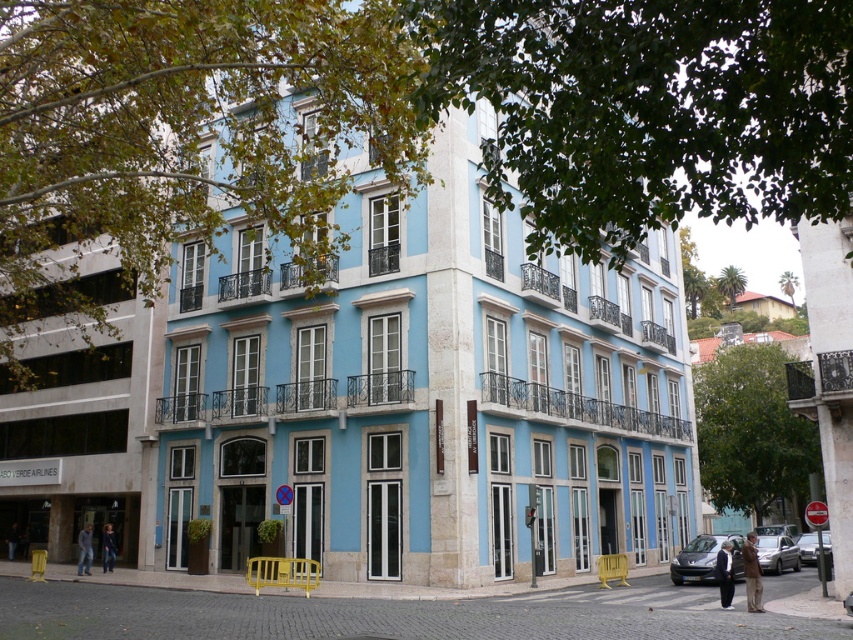
Question: Which of these objects is positioned closest to the dark brown leather jacket at lower left?

Choices:
 (A) brown leather jacket at lower right
 (B) dark gray suit at lower right

Answer: (B)

Question: Is dark gray suit at lower right above dark brown leather jacket at lower left?

Choices:
 (A) yes
 (B) no

Answer: (A)

Question: Considering the relative positions of denim jacket at lower left and dark brown leather jacket at lower left in the image provided, where is denim jacket at lower left located with respect to dark brown leather jacket at lower left?

Choices:
 (A) below
 (B) above

Answer: (B)

Question: Is brown leather jacket at lower right smaller than dark gray suit at lower right?

Choices:
 (A) no
 (B) yes

Answer: (B)

Question: Among these points, which one is farthest from the camera?

Choices:
 (A) (88, 532)
 (B) (107, 561)

Answer: (B)

Question: Which point is closer to the camera?

Choices:
 (A) pos(80,561)
 (B) pos(722,557)
 (C) pos(113,556)

Answer: (B)